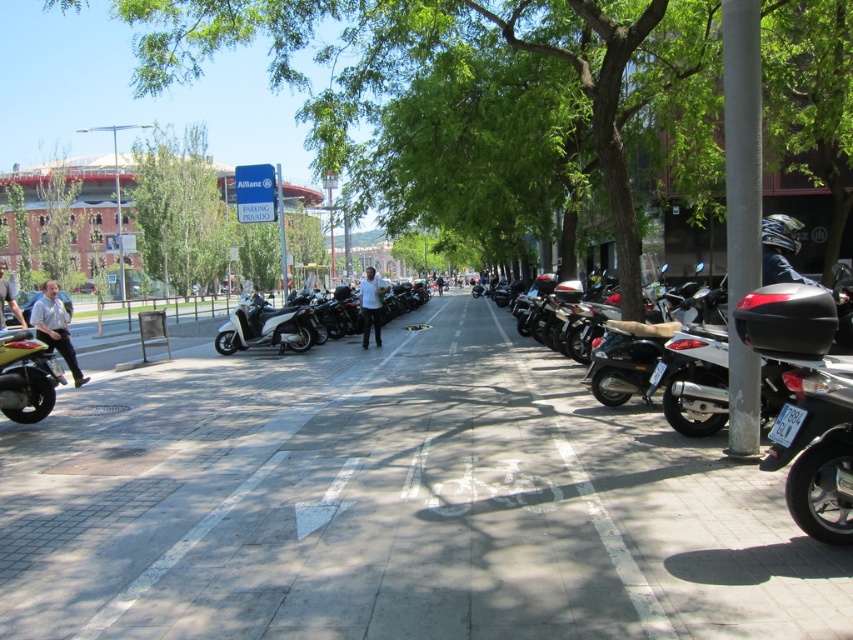
Can you confirm if gray concrete pavement at center is shorter than light brown leather jacket at left?

Indeed, gray concrete pavement at center has a lesser height compared to light brown leather jacket at left.

This screenshot has width=853, height=640. In order to click on gray concrete pavement at center in this screenshot , I will do `click(393, 504)`.

This screenshot has width=853, height=640. What are the coordinates of `gray concrete pavement at center` in the screenshot? It's located at (393, 504).

Measure the distance from gray concrete pavement at center to light blue shirt at left.

gray concrete pavement at center and light blue shirt at left are 4.59 meters apart.

Where is `gray concrete pavement at center`? The width and height of the screenshot is (853, 640). gray concrete pavement at center is located at coordinates (393, 504).

I want to click on gray concrete pavement at center, so click(x=393, y=504).

Between white matte shirt at center and light brown leather jacket at left, which one appears on the left side from the viewer's perspective?

Positioned to the left is light brown leather jacket at left.

Can you confirm if white matte shirt at center is smaller than light brown leather jacket at left?

Correct, white matte shirt at center occupies less space than light brown leather jacket at left.

Find the location of a particular element. This screenshot has width=853, height=640. white matte shirt at center is located at coordinates (370, 305).

Locate an element on the screen. white matte shirt at center is located at coordinates (370, 305).